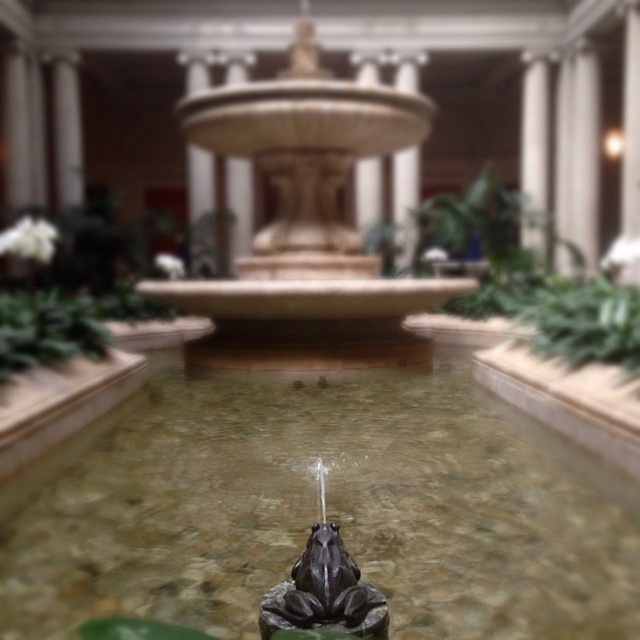
You are a visitor at the museum and want to take a photo of the clear water at center and the beige stone fountain at center. Which one should you focus on first if you want to capture both in a single shot without moving the camera?

You should focus on the beige stone fountain at center first because it is above the clear water at center, so adjusting focus to the closer object first would allow both to be in the frame.

You are an architect designing a new exhibit and need to ensure the clear water at center and the green leafy plant at center fit within a 2 meter wide display area. Given their widths, will both fit side by side?

The clear water at center is narrower than the green leafy plant at center. To determine if both can fit side by side, we need to know the combined width of both objects. However, since the exact widths aren

You are standing in the grand architectural space where the indoor fountain is located. You notice two points marked in the scene. The first point is at coordinates point (314, 100), and the second is at point (371, 237). If you were to walk from the first point to the second point, would you be moving towards the fountain or away from it?

Point (314, 100) is in front of point (371, 237). Therefore, moving from the first point to the second point would mean moving away from the fountain since the second point is behind the first one relative to the observer.